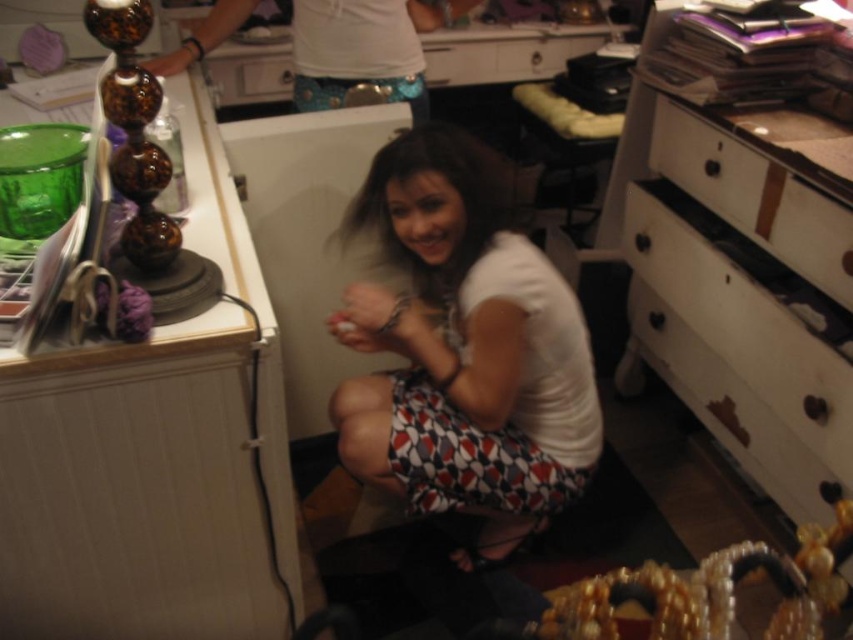
Question: Which object is the closest to the white wood drawer at center?

Choices:
 (A) white wood drawer at lower right
 (B) white wood drawer at center right
 (C) white cotton shirt at center

Answer: (B)

Question: Does white painted wood dresser at right have a greater width compared to white wood drawer at lower right?

Choices:
 (A) no
 (B) yes

Answer: (B)

Question: Which point appears farthest from the camera in this image?

Choices:
 (A) (732, 282)
 (B) (737, 160)
 (C) (569, 380)

Answer: (A)

Question: Does white cotton shirt at center appear over white glossy drawer at upper center?

Choices:
 (A) no
 (B) yes

Answer: (A)

Question: Among these objects, which one is farthest from the camera?

Choices:
 (A) white glossy drawer at upper center
 (B) white wood drawer at lower right

Answer: (A)

Question: Is white cotton shirt at center positioned at the back of white wood drawer at lower right?

Choices:
 (A) no
 (B) yes

Answer: (A)